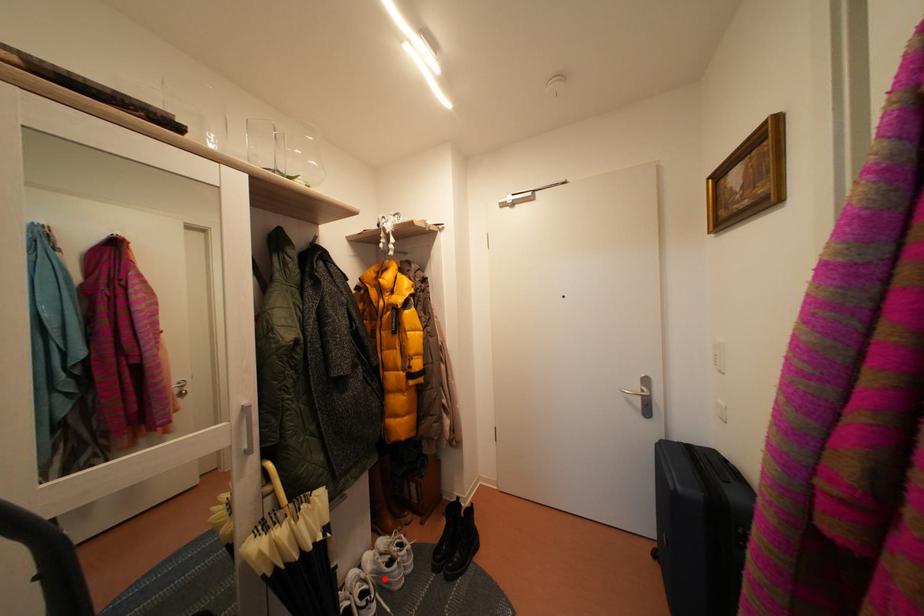
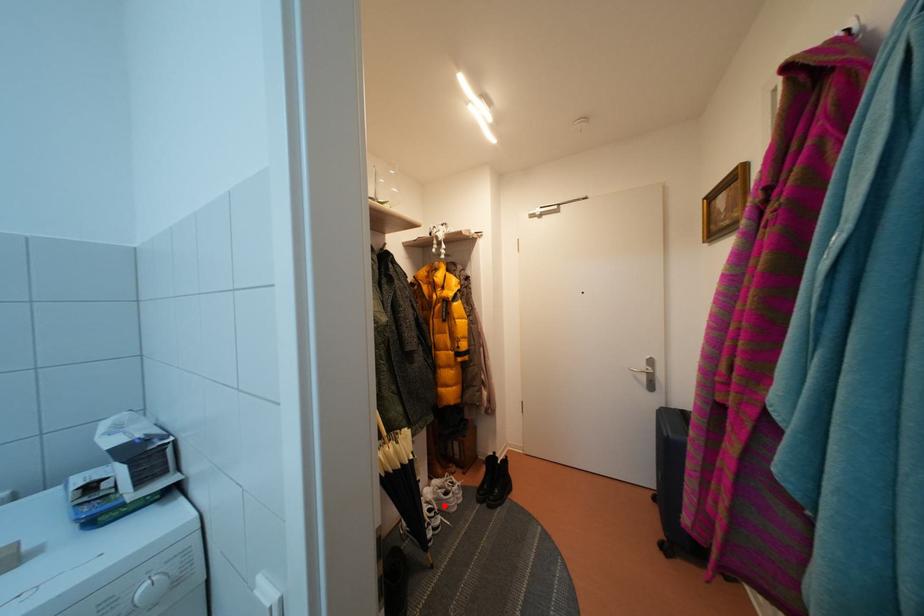
I am providing you with two images of the same scene from different viewpoints. A red point is marked on the first image and another point is marked on the second image. Do the highlighted points in image1 and image2 indicate the same real-world spot?

Yes